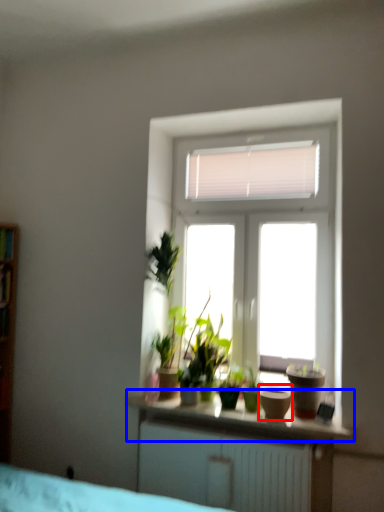
Question: Which of the following is the closest to the observer, flowerpot (highlighted by a red box) or window sill (highlighted by a blue box)?

Choices:
 (A) flowerpot
 (B) window sill

Answer: (B)